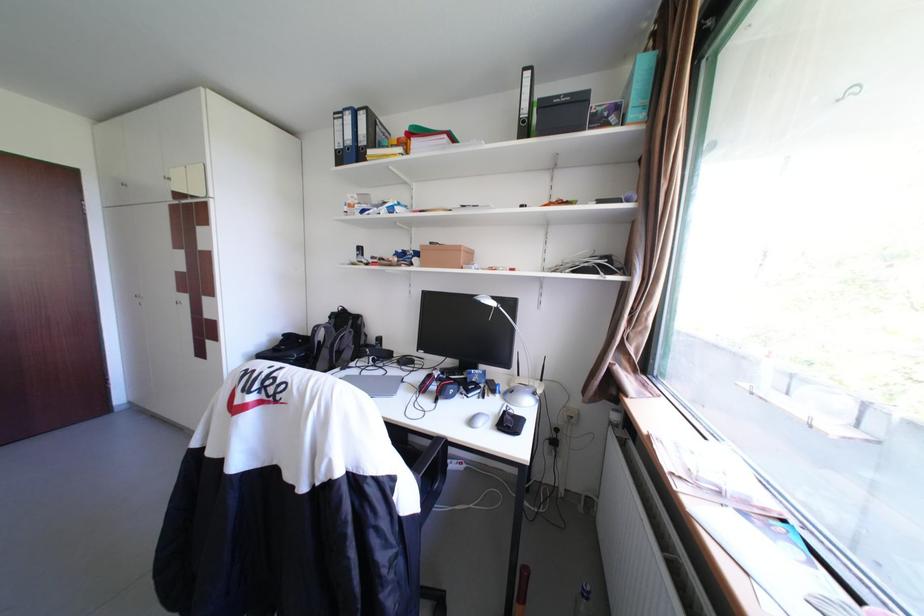
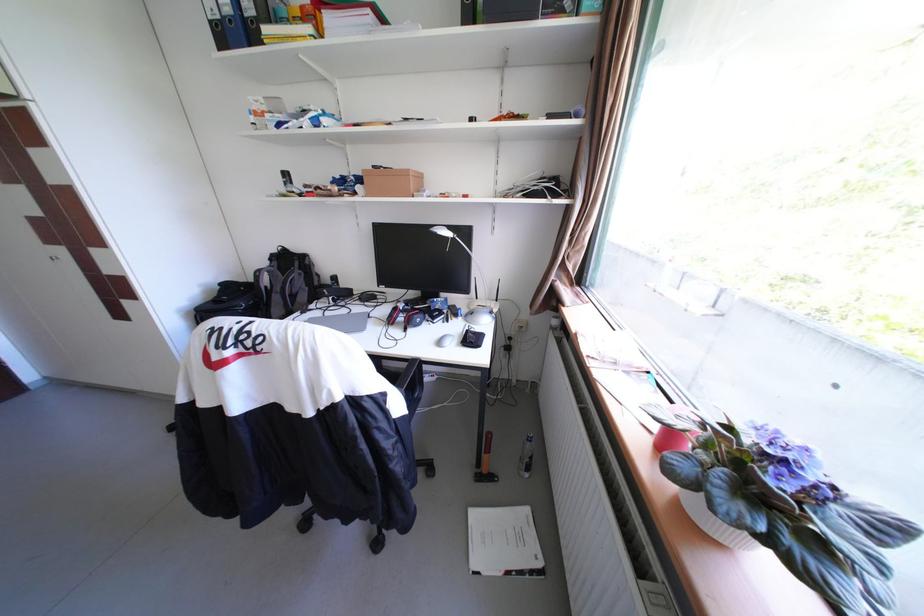
Question: Which direction would the cameraman need to move to produce the second image? Reply with the corresponding letter.

Choices:
 (A) Left
 (B) Right
 (C) Forward
 (D) Backward

Answer: (D)